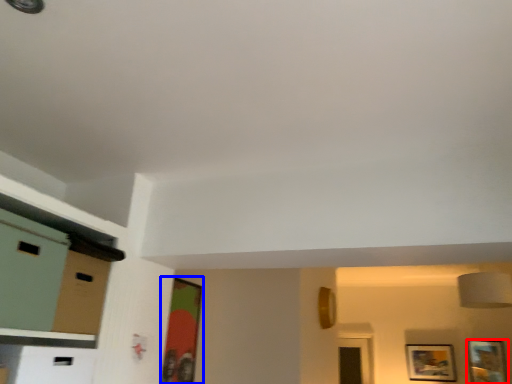
Question: Which point is closer to the camera, picture frame (highlighted by a red box) or picture frame (highlighted by a blue box)?

Choices:
 (A) picture frame
 (B) picture frame

Answer: (B)